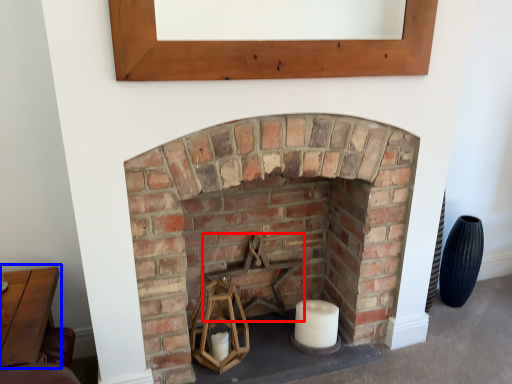
Question: Which object is further to the camera taking this photo, armchair (highlighted by a red box) or table (highlighted by a blue box)?

Choices:
 (A) armchair
 (B) table

Answer: (A)